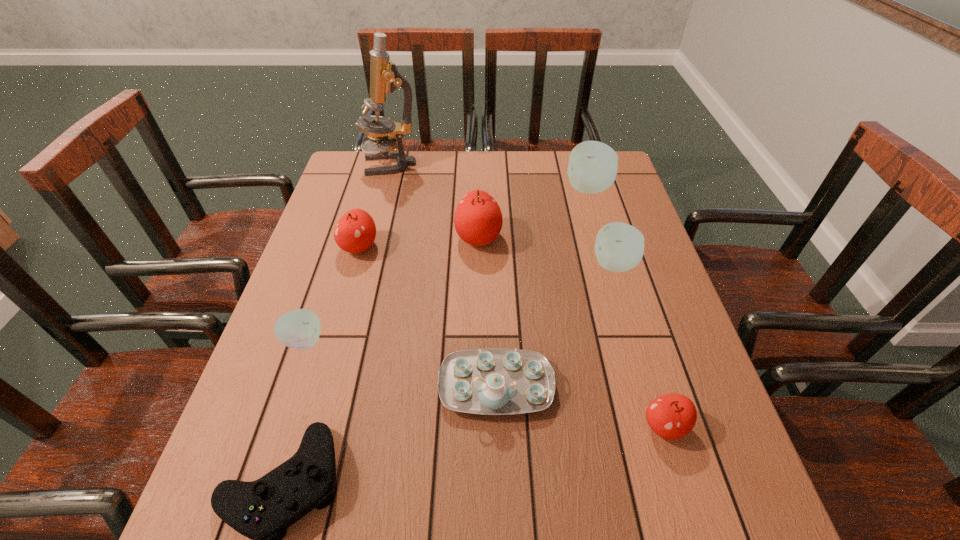
Find the location of `free space between the leftmost white apple and the biggest white apple`. free space between the leftmost white apple and the biggest white apple is located at coordinates (446, 265).

The height and width of the screenshot is (540, 960). Find the location of `empty space that is in between the second red apple from right to left and the second biggest red apple`. empty space that is in between the second red apple from right to left and the second biggest red apple is located at coordinates (419, 242).

Locate an element on the screen. unoccupied position between the smallest white apple and the second nearest white apple is located at coordinates (459, 303).

The image size is (960, 540). I want to click on free space between the second biggest white apple and the smallest white apple, so click(x=459, y=303).

Identify the location of empty space that is in between the chinaware and the second biggest red apple. This screenshot has width=960, height=540. (427, 316).

Where is `vacant area that lies between the second biggest white apple and the tallest object`? vacant area that lies between the second biggest white apple and the tallest object is located at coordinates click(x=503, y=214).

I want to click on free space between the rightmost red apple and the leftmost red apple, so click(x=512, y=336).

Locate an element on the screen. free space between the second smallest red apple and the rightmost red apple is located at coordinates (512, 336).

Locate an element on the screen. The image size is (960, 540). the second closest object to the fourth apple from right to left is located at coordinates (592, 168).

At what (x,y) coordinates should I click in order to perform the action: click on object that can be found as the sixth closest to the tallest object. Please return your answer as a coordinate pair (x, y). Looking at the image, I should click on pyautogui.click(x=493, y=381).